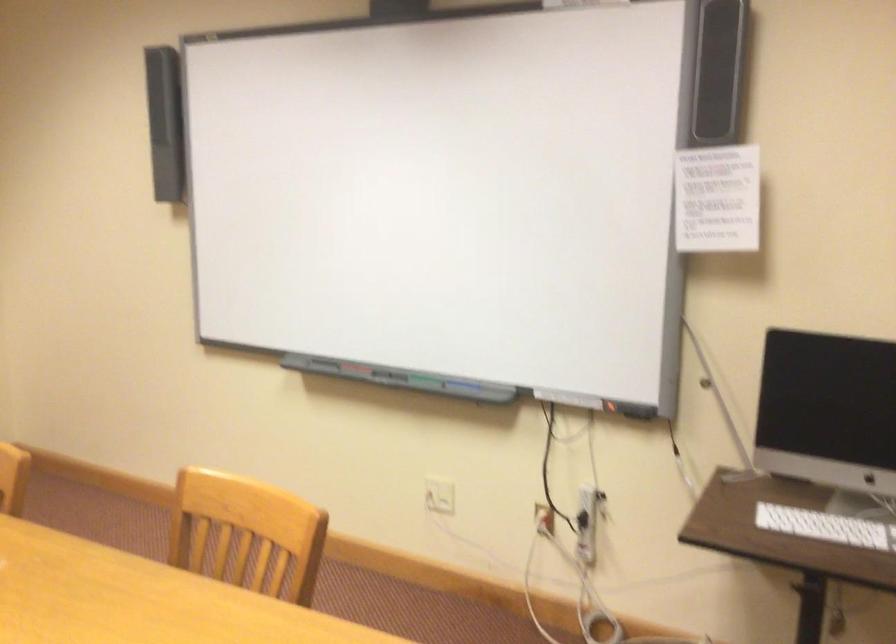
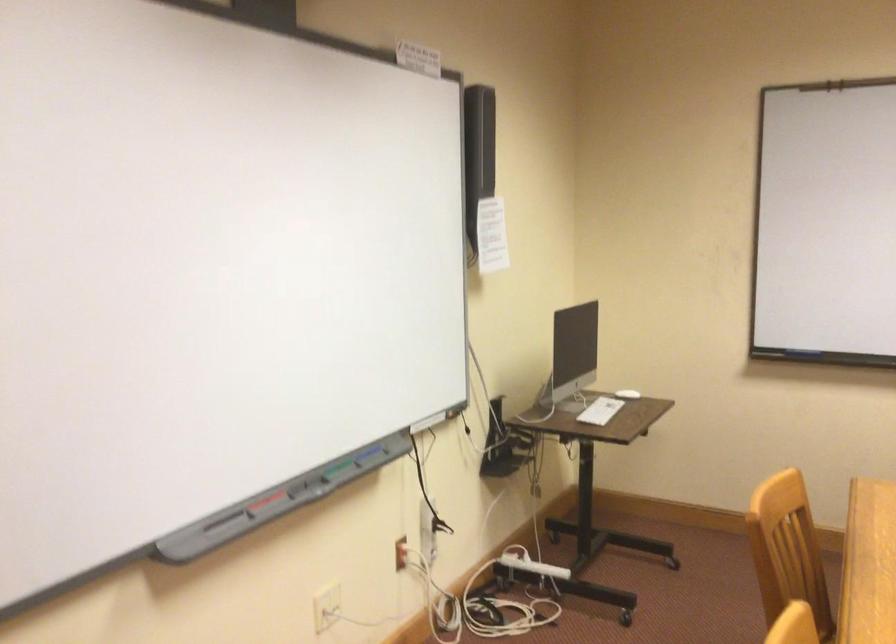
Where in the second image is the point corresponding to point 477,390 from the first image?

(368, 453)